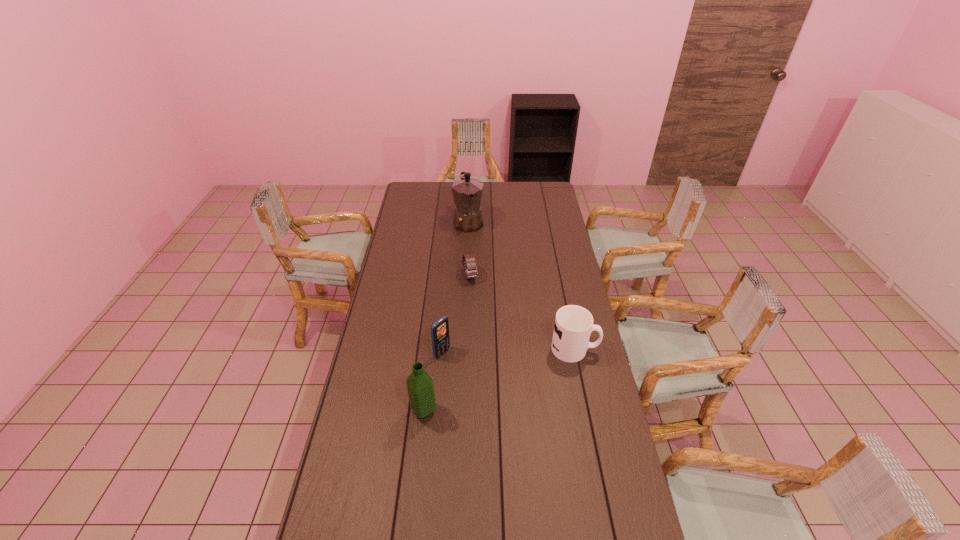
In the image, there is a desktop. At what (x,y) coordinates should I click in order to perform the action: click on blank space at the left edge. Please return your answer as a coordinate pair (x, y). Looking at the image, I should click on [x=415, y=254].

This screenshot has height=540, width=960. In order to click on free space at the right edge of the desktop in this screenshot , I will do `click(599, 425)`.

In the image, there is a desktop. Where is `vacant space at the far left corner`? vacant space at the far left corner is located at coordinates (415, 189).

Image resolution: width=960 pixels, height=540 pixels. What are the coordinates of `vacant region between the mug and the water bottle` in the screenshot? It's located at (499, 380).

Where is `vacant area that lies between the coffeepot and the fourth nearest object`? This screenshot has height=540, width=960. vacant area that lies between the coffeepot and the fourth nearest object is located at coordinates 469,249.

Where is `vacant point located between the mug and the cellular telephone`? vacant point located between the mug and the cellular telephone is located at coordinates 509,351.

At what (x,y) coordinates should I click in order to perform the action: click on unoccupied position between the water bottle and the rightmost object. Please return your answer as a coordinate pair (x, y). The width and height of the screenshot is (960, 540). Looking at the image, I should click on (499, 380).

What are the coordinates of `vacant area between the cellular telephone and the tallest object` in the screenshot? It's located at (455, 287).

The height and width of the screenshot is (540, 960). I want to click on vacant space that is in between the water bottle and the farthest object, so click(x=446, y=316).

Find the location of a particular element. empty space that is in between the rightmost object and the nearest object is located at coordinates (499, 380).